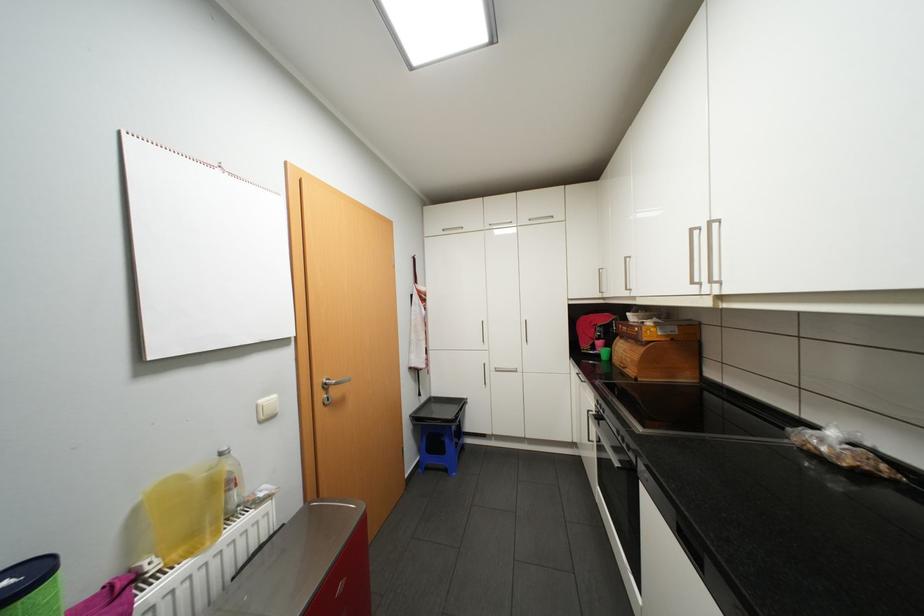
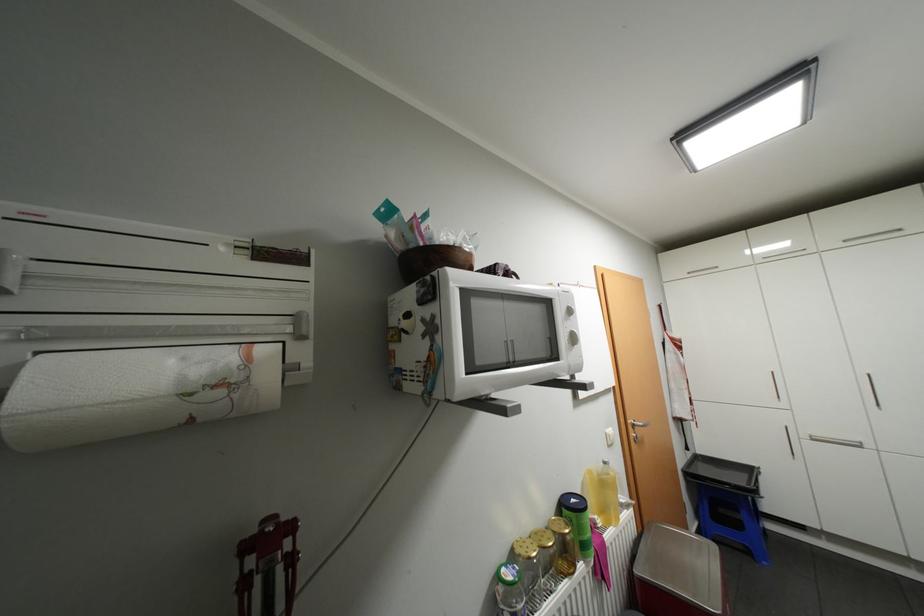
The point at (339, 387) is marked in the first image. Where is the corresponding point in the second image?

(643, 428)